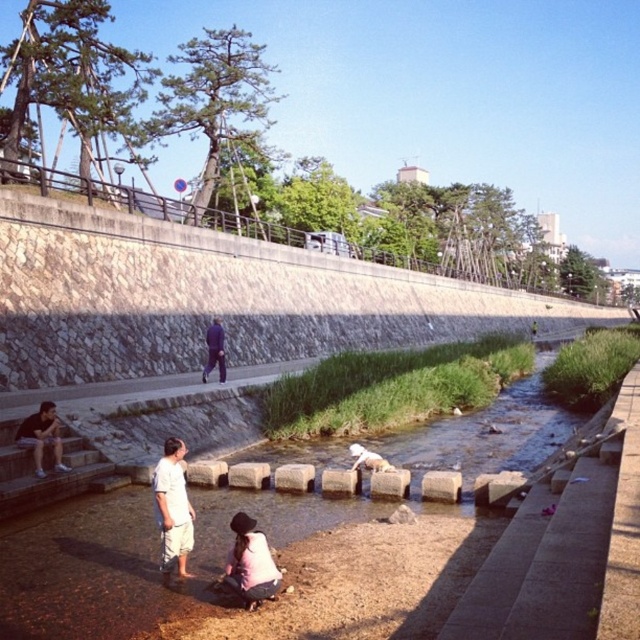
Can you confirm if matte black shirt at left is positioned below white cotton shirt at center?

Incorrect, matte black shirt at left is not positioned below white cotton shirt at center.

Between point (28, 417) and point (360, 454), which one is positioned behind?

Positioned behind is point (360, 454).

This screenshot has height=640, width=640. In order to click on matte black shirt at left in this screenshot , I will do `click(42, 436)`.

The width and height of the screenshot is (640, 640). What do you see at coordinates (216, 298) in the screenshot?
I see `stone wall at upper left` at bounding box center [216, 298].

Is stone wall at upper left smaller than matte black shirt at left?

Actually, stone wall at upper left might be larger than matte black shirt at left.

Who is more forward, (x=138, y=333) or (x=58, y=442)?

Point (x=58, y=442)

Locate an element on the screen. Image resolution: width=640 pixels, height=640 pixels. stone wall at upper left is located at coordinates (216, 298).

Measure the distance between white cotton shirt at lower center and light pink fabric at lower center.

They are 4.03 meters apart.

Can you confirm if white cotton shirt at lower center is positioned below light pink fabric at lower center?

No.

This screenshot has width=640, height=640. What are the coordinates of `white cotton shirt at lower center` in the screenshot? It's located at (172, 508).

Where is `white cotton shirt at lower center`? The height and width of the screenshot is (640, 640). white cotton shirt at lower center is located at coordinates (172, 508).